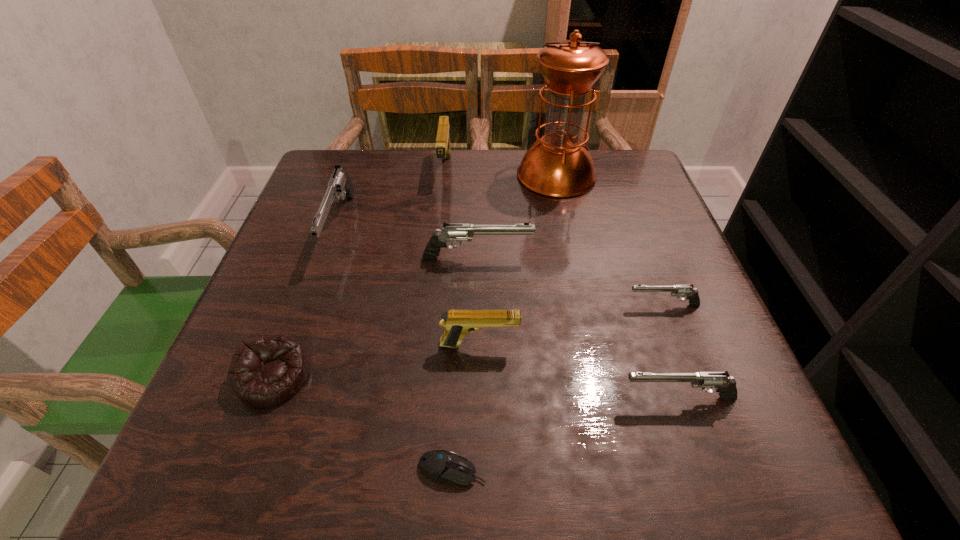
Find the location of a particular element. vacant region between the smaller tan pistol and the second shortest pistol is located at coordinates (579, 372).

You are a GUI agent. You are given a task and a screenshot of the screen. Output one action in this format:
    pyautogui.click(x=<x>, y=<y>)
    Task: Click on the free space between the right tan pistol and the sixth tallest object
    This screenshot has width=960, height=540.
    Given the screenshot: What is the action you would take?
    pyautogui.click(x=579, y=372)

The height and width of the screenshot is (540, 960). Identify the location of blank region between the smallest silver pistol and the fifth tallest pistol. (670, 352).

Locate an element on the screen. unoccupied position between the computer mouse and the leftmost pistol is located at coordinates (396, 348).

Locate an element on the screen. This screenshot has height=540, width=960. vacant space that's between the farther tan pistol and the second biggest silver pistol is located at coordinates point(461,213).

The width and height of the screenshot is (960, 540). In order to click on empty space that is in between the third silver pistol from right to left and the fourth shortest object in this screenshot , I will do `click(577, 328)`.

The height and width of the screenshot is (540, 960). I want to click on vacant area between the fourth shortest object and the beanbag, so click(x=476, y=388).

Locate an element on the screen. The width and height of the screenshot is (960, 540). unoccupied area between the right tan pistol and the nearest object is located at coordinates (466, 407).

Where is `free space between the sixth tallest object and the bigger tan pistol`? free space between the sixth tallest object and the bigger tan pistol is located at coordinates (562, 284).

Identify the location of the eighth closest object relative to the second shortest pistol. (443, 147).